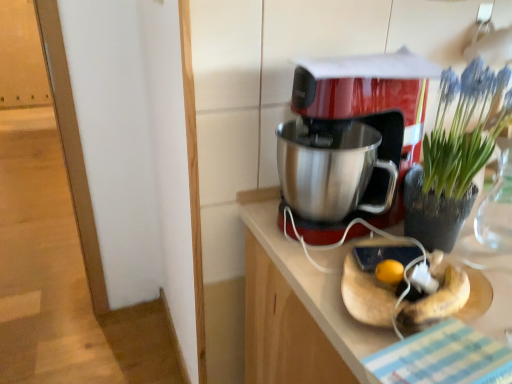
Question: Does point (411, 173) appear closer or farther from the camera than point (251, 334)?

Choices:
 (A) farther
 (B) closer

Answer: (B)

Question: Based on their sizes in the image, would you say green leafy plant at upper right is bigger or smaller than stainless steel countertop at center?

Choices:
 (A) big
 (B) small

Answer: (B)

Question: Which object is the farthest from the stainless steel countertop at center?

Choices:
 (A) green leafy plant at upper right
 (B) metallic red coffee maker at center

Answer: (A)

Question: Based on their relative distances, which object is farther from the metallic red coffee maker at center?

Choices:
 (A) stainless steel countertop at center
 (B) green leafy plant at upper right

Answer: (A)